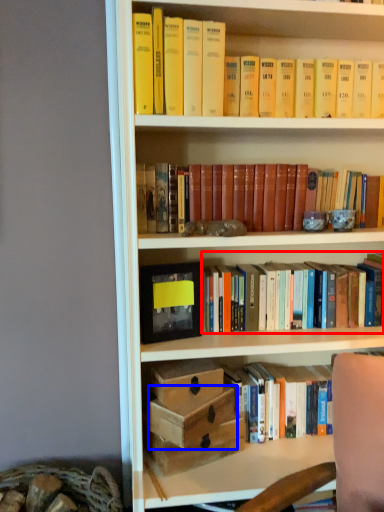
Question: Which object appears farthest to the camera in this image, book (highlighted by a red box) or box (highlighted by a blue box)?

Choices:
 (A) book
 (B) box

Answer: (A)